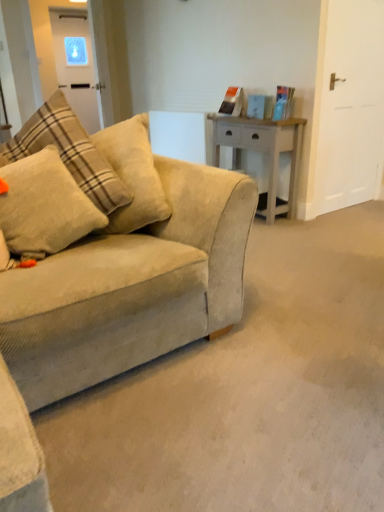
Question: Considering the relative positions of white matte door at right, which ranks as the second glass door in left-to-right order, and transparent glass door at upper left, the second glass door in the right-to-left sequence, in the image provided, is white matte door at right, which ranks as the second glass door in left-to-right order, to the left of transparent glass door at upper left, the second glass door in the right-to-left sequence, from the viewer's perspective?

Choices:
 (A) yes
 (B) no

Answer: (B)

Question: Can you confirm if white matte door at right, which is the 1th glass door from right to left, is wider than transparent glass door at upper left, the second glass door in the right-to-left sequence?

Choices:
 (A) yes
 (B) no

Answer: (B)

Question: Is white matte door at right, which is the 1th glass door in front-to-back order, far from transparent glass door at upper left, arranged as the 1th glass door when viewed from the back?

Choices:
 (A) yes
 (B) no

Answer: (A)

Question: Could you tell me if white matte door at right, marked as the second glass door in a back-to-front arrangement, is turned towards transparent glass door at upper left, which ranks as the 1th glass door in left-to-right order?

Choices:
 (A) no
 (B) yes

Answer: (A)

Question: Can transparent glass door at upper left, which ranks as the 1th glass door in left-to-right order, be found inside white matte door at right, which is the 1th glass door from right to left?

Choices:
 (A) no
 (B) yes

Answer: (A)

Question: In terms of width, does white matte door at right, marked as the second glass door in a back-to-front arrangement, look wider or thinner when compared to fluffy beige pillow at left?

Choices:
 (A) wide
 (B) thin

Answer: (B)

Question: Is white matte door at right, which is the 1th glass door in front-to-back order, bigger or smaller than fluffy beige pillow at left?

Choices:
 (A) small
 (B) big

Answer: (B)

Question: Relative to fluffy beige pillow at left, is white matte door at right, which ranks as the second glass door in left-to-right order, in front or behind?

Choices:
 (A) front
 (B) behind

Answer: (B)

Question: From their relative heights in the image, would you say white matte door at right, marked as the second glass door in a back-to-front arrangement, is taller or shorter than fluffy beige pillow at left?

Choices:
 (A) tall
 (B) short

Answer: (A)

Question: From the image's perspective, is transparent glass door at upper left, which ranks as the 1th glass door in left-to-right order, above or below white matte door at right, which is the 1th glass door from right to left?

Choices:
 (A) below
 (B) above

Answer: (B)

Question: In terms of size, does transparent glass door at upper left, which ranks as the 1th glass door in left-to-right order, appear bigger or smaller than white matte door at right, marked as the second glass door in a back-to-front arrangement?

Choices:
 (A) big
 (B) small

Answer: (A)

Question: From their relative heights in the image, would you say transparent glass door at upper left, which ranks as the 1th glass door in left-to-right order, is taller or shorter than white matte door at right, which is the 1th glass door from right to left?

Choices:
 (A) tall
 (B) short

Answer: (B)

Question: Is transparent glass door at upper left, arranged as the 1th glass door when viewed from the back, wider or thinner than white matte door at right, which is the 1th glass door in front-to-back order?

Choices:
 (A) thin
 (B) wide

Answer: (B)

Question: Would you say transparent glass door at upper left, which ranks as the 1th glass door in left-to-right order, is to the left or to the right of fluffy beige pillow at left in the picture?

Choices:
 (A) left
 (B) right

Answer: (A)

Question: Relative to fluffy beige pillow at left, is transparent glass door at upper left, the second glass door in the right-to-left sequence, in front or behind?

Choices:
 (A) behind
 (B) front

Answer: (A)